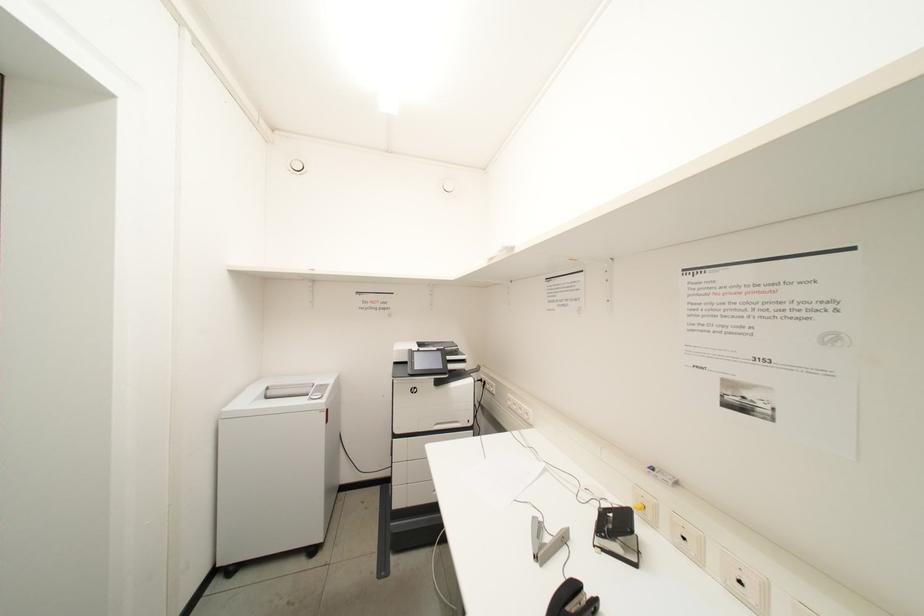
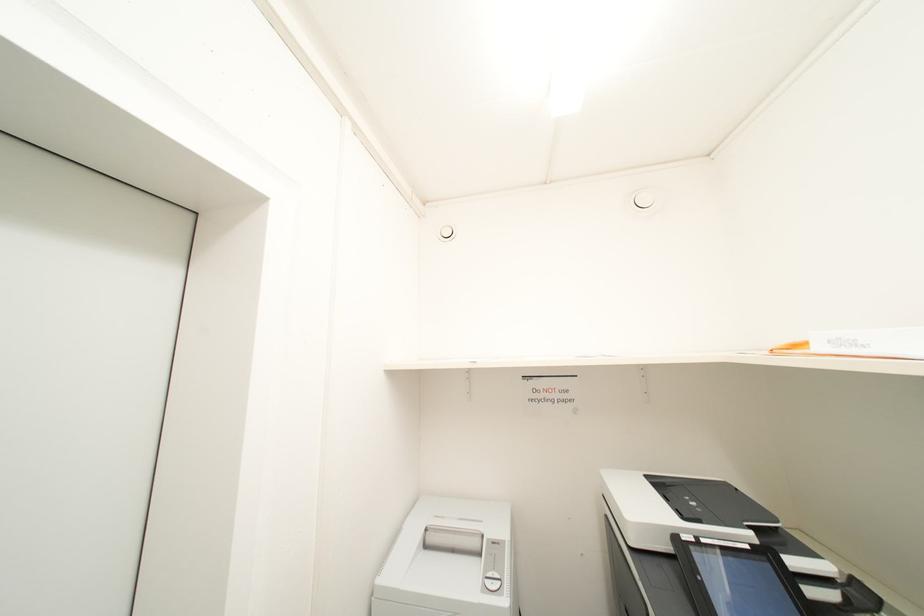
Question: The camera is either moving clockwise (left) or counter-clockwise (right) around the object. The first image is from the beginning of the video and the second image is from the end. Is the camera moving left or right when shooting the video?

Choices:
 (A) Left
 (B) Right

Answer: (B)